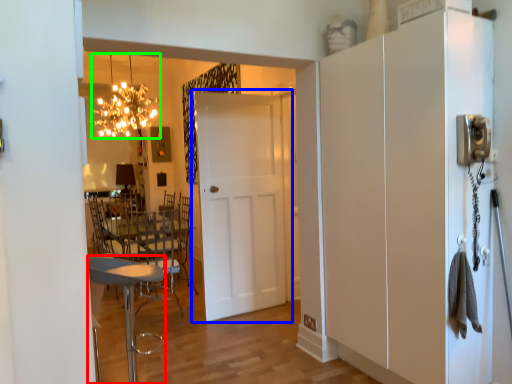
Question: Based on their relative distances, which object is nearer to chair (highlighted by a red box)? Choose from door (highlighted by a blue box) and light fixture (highlighted by a green box).

Choices:
 (A) door
 (B) light fixture

Answer: (A)